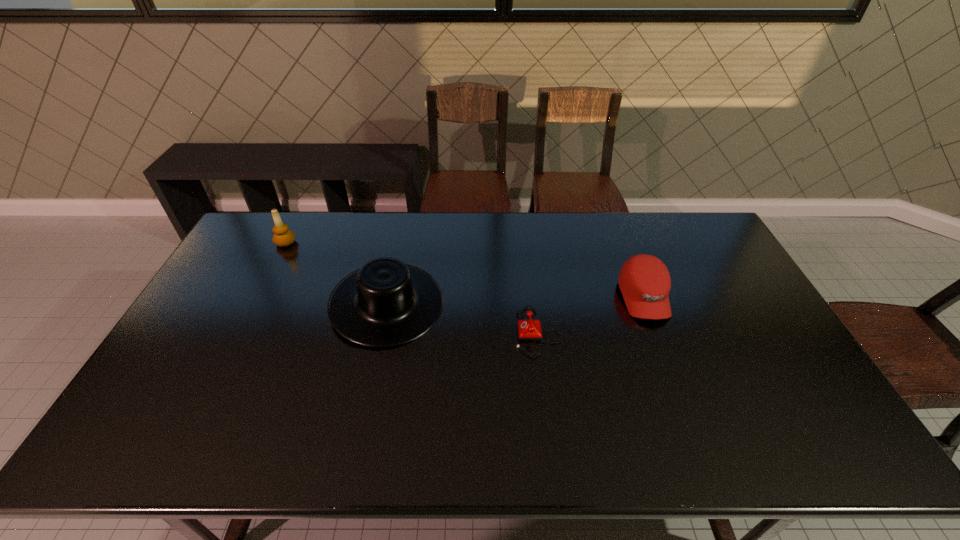
At what (x,y) coordinates should I click in order to perform the action: click on free region located on the dial of the telephone. Please return your answer as a coordinate pair (x, y). This screenshot has width=960, height=540. Looking at the image, I should click on (392, 332).

The height and width of the screenshot is (540, 960). In order to click on free space located 0.060m on the dial of the telephone in this screenshot , I will do `click(494, 332)`.

You are a GUI agent. You are given a task and a screenshot of the screen. Output one action in this format:
    pyautogui.click(x=<x>, y=<y>)
    Task: Click on the free space located 0.130m on the dial of the telephone
    This screenshot has width=960, height=540.
    Given the screenshot: What is the action you would take?
    pyautogui.click(x=470, y=332)

Where is `object located in the far edge section of the desktop`? This screenshot has width=960, height=540. object located in the far edge section of the desktop is located at coordinates (283, 237).

Where is `object located at the left edge`? object located at the left edge is located at coordinates (283, 237).

This screenshot has height=540, width=960. Identify the location of object at the far left corner. coord(283,237).

The image size is (960, 540). What are the coordinates of `vacant area at the far edge of the desktop` in the screenshot? It's located at (370, 242).

The image size is (960, 540). I want to click on vacant space at the near edge of the desktop, so click(x=721, y=453).

The width and height of the screenshot is (960, 540). In the image, there is a desktop. Find the location of `free region at the left edge`. free region at the left edge is located at coordinates (189, 417).

In the image, there is a desktop. Identify the location of vacant space at the right edge. (725, 320).